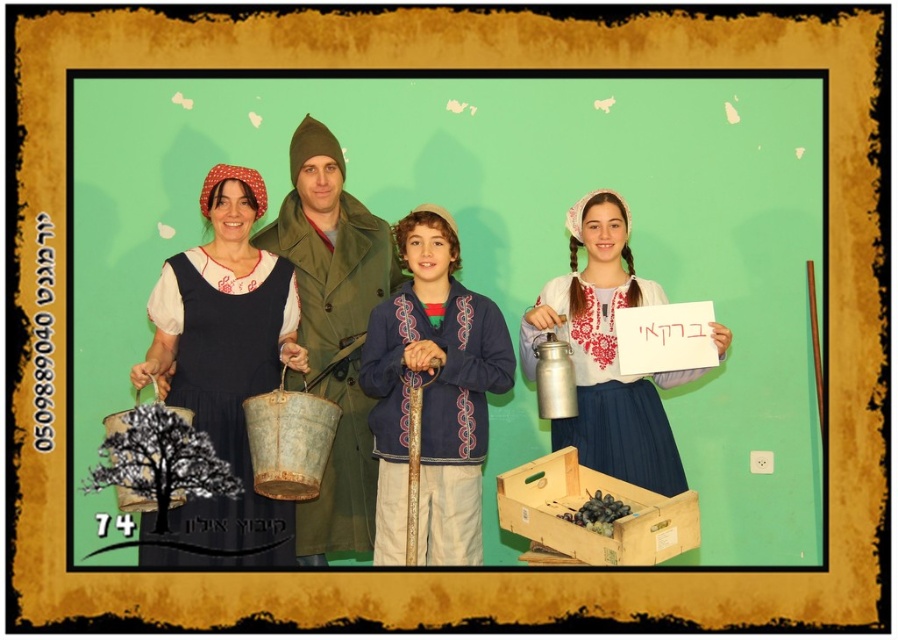
You are organizing a display and need to place the green fabric coat at center and the metallic silver milk can at right on a shelf. Which item requires more horizontal space on the shelf?

The metallic silver milk can at right requires more horizontal space because its width is greater than the green fabric coat at center.

You are a photographer trying to adjust the lighting for a photo shoot. You notice the matte blue dress at left and the green fabric coat at center. Which object is closer to the bottom of the image?

The matte blue dress at left is positioned under the green fabric coat at center, meaning it is closer to the bottom of the image.